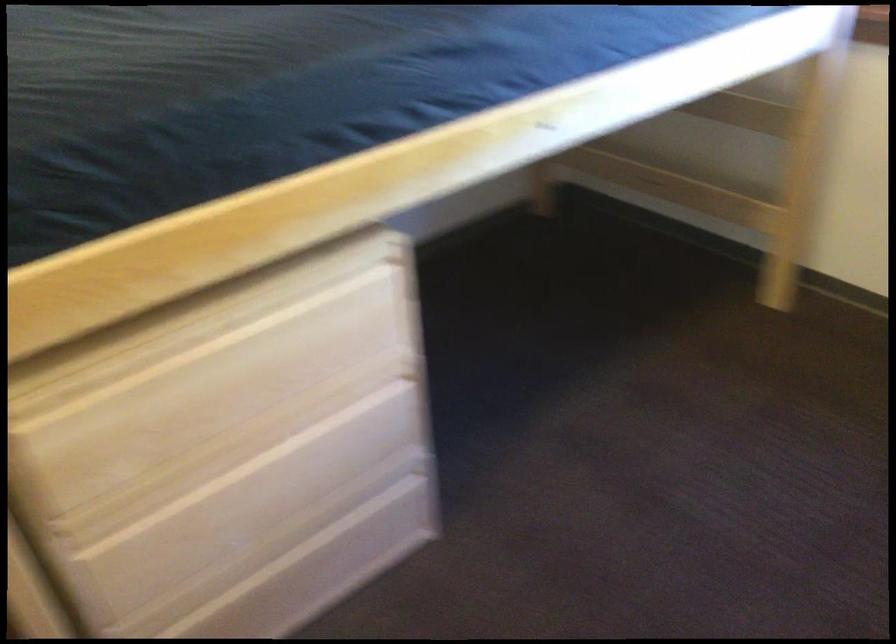
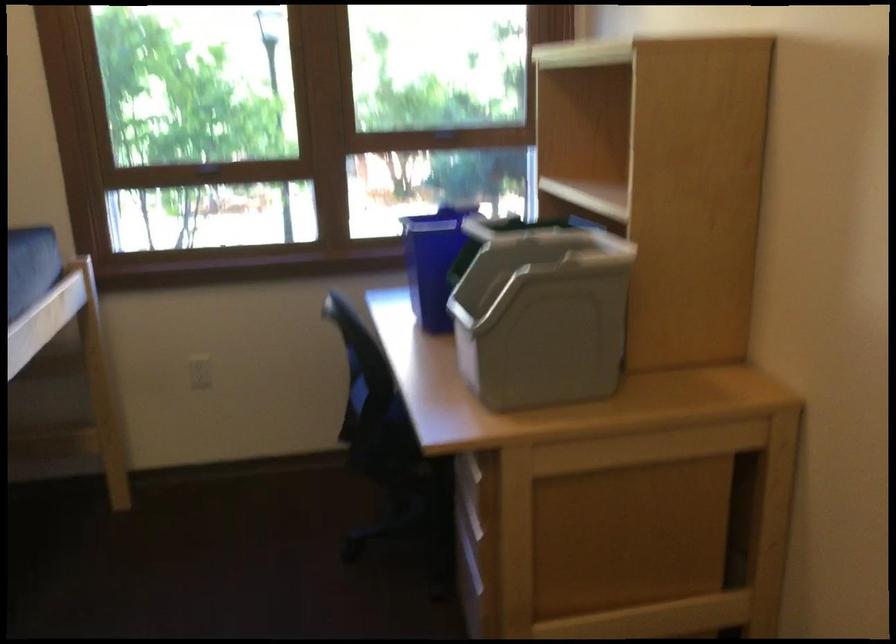
Question: The camera is either moving clockwise (left) or counter-clockwise (right) around the object. The first image is from the beginning of the video and the second image is from the end. Is the camera moving left or right when shooting the video?

Choices:
 (A) Left
 (B) Right

Answer: (A)